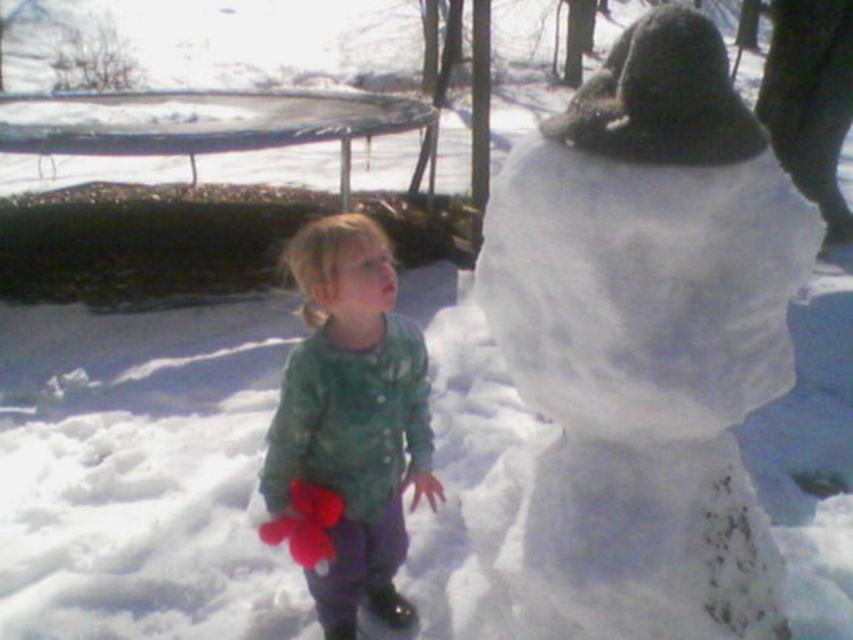
Does white fluffy snowman at upper right lie behind green textured coat at center?

No, it is not.

Which of these two, white fluffy snowman at upper right or green textured coat at center, stands taller?

Standing taller between the two is white fluffy snowman at upper right.

Who is more distant from viewer, (711, 358) or (386, 339)?

Point (386, 339)

The height and width of the screenshot is (640, 853). In order to click on white fluffy snowman at upper right in this screenshot , I will do `click(648, 337)`.